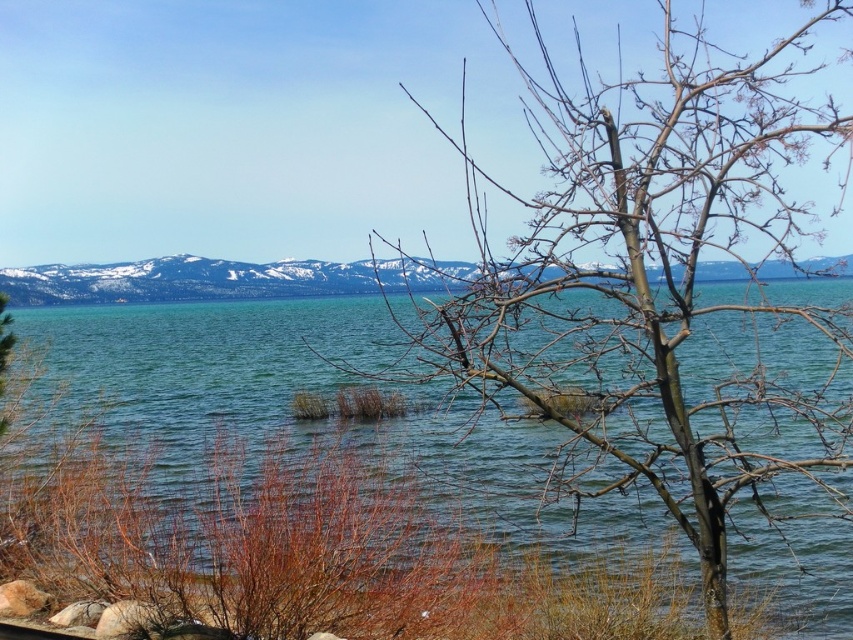
Question: Based on their relative distances, which object is farther from the snowy mountain at center?

Choices:
 (A) clear water at center
 (B) bare branches at center

Answer: (B)

Question: Which object is closer to the camera taking this photo?

Choices:
 (A) bare branches at center
 (B) snowy mountain at center
 (C) clear water at center

Answer: (A)

Question: Can you confirm if bare branches at center is wider than clear water at center?

Choices:
 (A) no
 (B) yes

Answer: (A)

Question: Does bare branches at center lie in front of snowy mountain at center?

Choices:
 (A) no
 (B) yes

Answer: (B)

Question: Is clear water at center further to camera compared to snowy mountain at center?

Choices:
 (A) no
 (B) yes

Answer: (B)

Question: Based on their relative distances, which object is nearer to the bare branches at center?

Choices:
 (A) clear water at center
 (B) snowy mountain at center

Answer: (B)